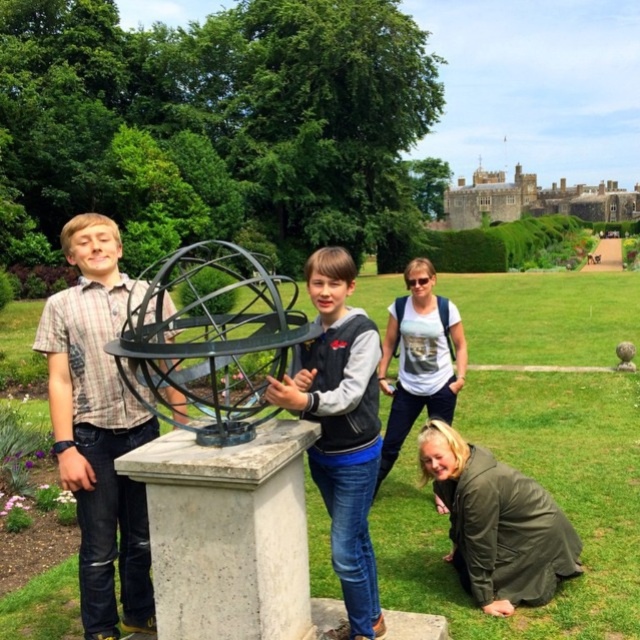
Question: Which of the following is the farthest from the observer?

Choices:
 (A) (220, 388)
 (B) (509, 592)

Answer: (A)

Question: Is striped cotton shirt at left wider than black metal sphere at center?

Choices:
 (A) no
 (B) yes

Answer: (B)

Question: Which point appears farthest from the camera in this image?

Choices:
 (A) (397, 406)
 (B) (19, 608)
 (C) (362, 573)
 (D) (458, 548)

Answer: (A)

Question: Is striped cotton shirt at left thinner than black matte jacket at center?

Choices:
 (A) yes
 (B) no

Answer: (B)

Question: Among these points, which one is farthest from the camera?

Choices:
 (A) (72, 416)
 (B) (353, 428)
 (C) (598, 420)
 (D) (241, 321)

Answer: (C)

Question: Where is green matte jacket at lower right located in relation to white cotton t-shirt at center in the image?

Choices:
 (A) right
 (B) left

Answer: (A)